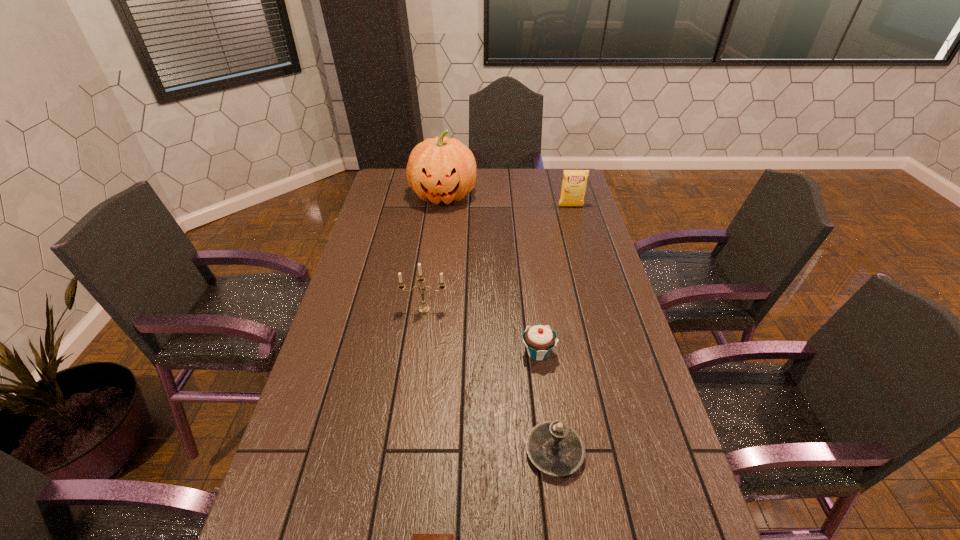
Identify the location of blank space located on the front of the crisp (potato chip) with the logo. (583, 247).

At what (x,y) coordinates should I click in order to perform the action: click on blank space located on the left of the nearer candle. Please return your answer as a coordinate pair (x, y). Looking at the image, I should click on pyautogui.click(x=452, y=451).

Where is `free space located on the left of the fourth farthest object`? free space located on the left of the fourth farthest object is located at coordinates (396, 353).

Find the location of `object located in the far edge section of the desktop`. object located in the far edge section of the desktop is located at coordinates (441, 169).

Locate an element on the screen. Image resolution: width=960 pixels, height=540 pixels. object that is at the left edge is located at coordinates (441, 169).

Image resolution: width=960 pixels, height=540 pixels. I want to click on object at the right edge, so click(574, 182).

Image resolution: width=960 pixels, height=540 pixels. Find the location of `object at the far left corner`. object at the far left corner is located at coordinates (441, 169).

Where is `vacant position at the far edge of the desktop`? This screenshot has width=960, height=540. vacant position at the far edge of the desktop is located at coordinates point(509,168).

Locate an element on the screen. Image resolution: width=960 pixels, height=540 pixels. vacant point at the left edge is located at coordinates (368, 213).

Find the location of `vacant space at the right edge of the desktop`. vacant space at the right edge of the desktop is located at coordinates (625, 314).